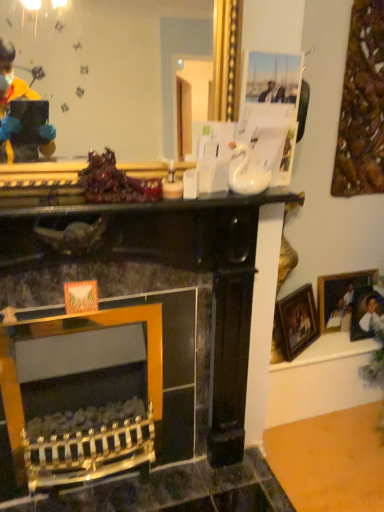
This screenshot has height=512, width=384. What do you see at coordinates (295, 323) in the screenshot?
I see `gold-framed picture at right, which is the second picture frame from right to left` at bounding box center [295, 323].

The height and width of the screenshot is (512, 384). Describe the element at coordinates (340, 296) in the screenshot. I see `wooden picture frame at right, acting as the 1th picture frame starting from the right` at that location.

I want to click on gold metallic mirror at upper center, so click(112, 69).

Where is `gold-framed picture at right, which is the second picture frame from right to left`? gold-framed picture at right, which is the second picture frame from right to left is located at coordinates (295, 323).

Does wooden picture frame at right, which is the 2th picture frame in left-to-right order, have a greater width compared to gold metallic mirror at upper center?

Yes, wooden picture frame at right, which is the 2th picture frame in left-to-right order, is wider than gold metallic mirror at upper center.

Does wooden picture frame at right, acting as the 1th picture frame starting from the right, have a lesser height compared to gold metallic mirror at upper center?

Correct, wooden picture frame at right, acting as the 1th picture frame starting from the right, is not as tall as gold metallic mirror at upper center.

From a real-world perspective, is wooden picture frame at right, acting as the 1th picture frame starting from the right, on gold metallic mirror at upper center?

No, from a real-world perspective, wooden picture frame at right, acting as the 1th picture frame starting from the right, is not above gold metallic mirror at upper center.

Considering the positions of points (351, 298) and (40, 47), is point (351, 298) farther from camera compared to point (40, 47)?

Yes, point (351, 298) is behind point (40, 47).

Consider the image. Could gold metallic mirror at upper center be considered to be inside shiny purple grapes at center?

Definitely not — gold metallic mirror at upper center is not inside shiny purple grapes at center.

Find the location of a particular element. The image size is (384, 512). mirror located on the right of shiny purple grapes at center is located at coordinates (112, 69).

Is point (88, 159) closer to camera compared to point (78, 118)?

No.

Consider the image. From the image's perspective, which one is positioned higher, gold-framed picture at right, the first picture frame when ordered from left to right, or gold metallic mirror at upper center?

gold metallic mirror at upper center is shown above in the image.

Which of these two, gold-framed picture at right, which is the second picture frame from right to left, or gold metallic mirror at upper center, is bigger?

gold metallic mirror at upper center is bigger.

Does gold-framed picture at right, the first picture frame when ordered from left to right, turn towards gold metallic mirror at upper center?

No, gold-framed picture at right, the first picture frame when ordered from left to right, is not turned towards gold metallic mirror at upper center.

Considering the relative sizes of gold metallic mirror at upper center and shiny purple grapes at center in the image provided, is gold metallic mirror at upper center wider than shiny purple grapes at center?

No.

Is gold metallic mirror at upper center positioned far away from shiny purple grapes at center?

gold metallic mirror at upper center is near shiny purple grapes at center, not far away.

Considering the sizes of objects gold metallic mirror at upper center and shiny purple grapes at center in the image provided, who is bigger, gold metallic mirror at upper center or shiny purple grapes at center?

Bigger between the two is gold metallic mirror at upper center.

Who is taller, gold metallic mirror at upper center or shiny purple grapes at center?

With more height is gold metallic mirror at upper center.

Would you say gold metallic mirror at upper center is inside or outside wooden picture frame at right, which is the 2th picture frame in left-to-right order?

gold metallic mirror at upper center is not inside wooden picture frame at right, which is the 2th picture frame in left-to-right order, it's outside.

Is gold metallic mirror at upper center touching wooden picture frame at right, which is the 2th picture frame in left-to-right order?

No, gold metallic mirror at upper center is not next to wooden picture frame at right, which is the 2th picture frame in left-to-right order.

Does point (68, 108) come in front of point (332, 318)?

Yes, it is in front of point (332, 318).

Is gold metallic mirror at upper center at the right side of wooden picture frame at right, which is the 2th picture frame in left-to-right order?

No, gold metallic mirror at upper center is not to the right of wooden picture frame at right, which is the 2th picture frame in left-to-right order.

Does shiny purple grapes at center touch gold-framed picture at right, the first picture frame when ordered from left to right?

No, shiny purple grapes at center is not touching gold-framed picture at right, the first picture frame when ordered from left to right.

Based on the photo, is shiny purple grapes at center oriented towards gold-framed picture at right, the first picture frame when ordered from left to right?

→ No, shiny purple grapes at center is not facing towards gold-framed picture at right, the first picture frame when ordered from left to right.

From the picture: Considering the relative positions of shiny purple grapes at center and gold-framed picture at right, which is the second picture frame from right to left, in the image provided, is shiny purple grapes at center to the right of gold-framed picture at right, which is the second picture frame from right to left, from the viewer's perspective?

No, shiny purple grapes at center is not to the right of gold-framed picture at right, which is the second picture frame from right to left.

Does point (105, 148) lie in front of point (290, 339)?

Yes, point (105, 148) is in front of point (290, 339).

From a real-world perspective, does gold metallic mirror at upper center stand above gold-framed picture at right, the first picture frame when ordered from left to right?

Yes, from a real-world perspective, gold metallic mirror at upper center is on top of gold-framed picture at right, the first picture frame when ordered from left to right.

Is gold metallic mirror at upper center aimed at gold-framed picture at right, the first picture frame when ordered from left to right?

No, gold metallic mirror at upper center is not oriented towards gold-framed picture at right, the first picture frame when ordered from left to right.

Where is `mirror to the left of wooden picture frame at right, acting as the 1th picture frame starting from the right`? mirror to the left of wooden picture frame at right, acting as the 1th picture frame starting from the right is located at coordinates pos(112,69).

At what (x,y) coordinates should I click in order to perform the action: click on food below the gold metallic mirror at upper center (from the image's perspective). Please return your answer as a coordinate pair (x, y). Looking at the image, I should click on (115, 182).

Estimate the real-world distances between objects in this image. Which object is further from gold-framed picture at right, the first picture frame when ordered from left to right, wooden picture frame at right, acting as the 1th picture frame starting from the right, or shiny purple grapes at center?

shiny purple grapes at center lies further to gold-framed picture at right, the first picture frame when ordered from left to right, than the other object.

Looking at the image, which one is located further to shiny purple grapes at center, wooden picture frame at right, which is the 2th picture frame in left-to-right order, or gold-framed picture at right, which is the second picture frame from right to left?

wooden picture frame at right, which is the 2th picture frame in left-to-right order, lies further to shiny purple grapes at center than the other object.

From the image, which object appears to be farther from gold-framed picture at right, the first picture frame when ordered from left to right, gold metallic mirror at upper center or wooden picture frame at right, which is the 2th picture frame in left-to-right order?

The object further to gold-framed picture at right, the first picture frame when ordered from left to right, is gold metallic mirror at upper center.

Looking at the image, which one is located closer to gold metallic mirror at upper center, shiny purple grapes at center or wooden picture frame at right, which is the 2th picture frame in left-to-right order?

Based on the image, shiny purple grapes at center appears to be nearer to gold metallic mirror at upper center.

Which object lies further to the anchor point wooden picture frame at right, which is the 2th picture frame in left-to-right order, gold metallic mirror at upper center or gold-framed picture at right, which is the second picture frame from right to left?

gold metallic mirror at upper center is positioned further to the anchor wooden picture frame at right, which is the 2th picture frame in left-to-right order.

Which object lies further to the anchor point shiny purple grapes at center, wooden picture frame at right, which is the 2th picture frame in left-to-right order, or gold metallic mirror at upper center?

wooden picture frame at right, which is the 2th picture frame in left-to-right order, is positioned further to the anchor shiny purple grapes at center.

Looking at this image, when comparing their distances from gold metallic mirror at upper center, does wooden picture frame at right, acting as the 1th picture frame starting from the right, or shiny purple grapes at center seem further?

wooden picture frame at right, acting as the 1th picture frame starting from the right, lies further to gold metallic mirror at upper center than the other object.

In the scene shown: Based on their spatial positions, is gold-framed picture at right, the first picture frame when ordered from left to right, or wooden picture frame at right, acting as the 1th picture frame starting from the right, closer to shiny purple grapes at center?

gold-framed picture at right, the first picture frame when ordered from left to right.

Where is `food between gold metallic mirror at upper center and gold-framed picture at right, which is the second picture frame from right to left, from front to back`? food between gold metallic mirror at upper center and gold-framed picture at right, which is the second picture frame from right to left, from front to back is located at coordinates (115, 182).

Where is `picture frame positioned between gold metallic mirror at upper center and wooden picture frame at right, acting as the 1th picture frame starting from the right, from near to far`? picture frame positioned between gold metallic mirror at upper center and wooden picture frame at right, acting as the 1th picture frame starting from the right, from near to far is located at coordinates (295, 323).

In order to click on picture frame located between shiny purple grapes at center and wooden picture frame at right, which is the 2th picture frame in left-to-right order, in the left-right direction in this screenshot , I will do `click(295, 323)`.

You are a GUI agent. You are given a task and a screenshot of the screen. Output one action in this format:
    pyautogui.click(x=<x>, y=<y>)
    Task: Click on the food between gold metallic mirror at upper center and wooden picture frame at right, which is the 2th picture frame in left-to-right order, along the z-axis
    The height and width of the screenshot is (512, 384).
    Given the screenshot: What is the action you would take?
    pyautogui.click(x=115, y=182)